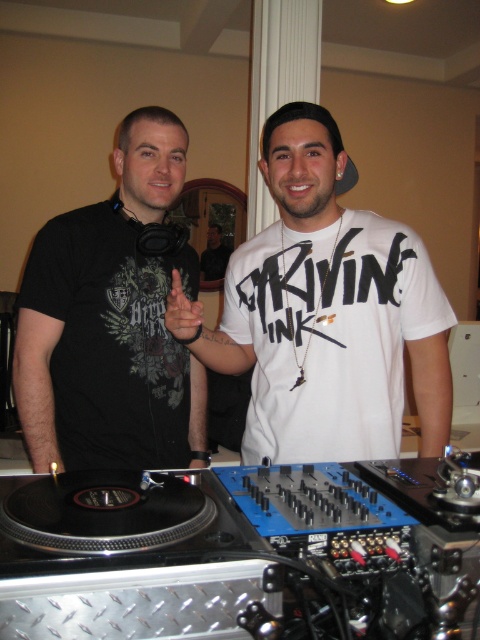
Question: Which object is closer to the camera taking this photo?

Choices:
 (A) white matte t-shirt at center
 (B) black matte t-shirt at left

Answer: (A)

Question: Does white matte t-shirt at center have a lesser width compared to black matte t-shirt at left?

Choices:
 (A) yes
 (B) no

Answer: (B)

Question: Which point is closer to the camera taking this photo?

Choices:
 (A) (385, 308)
 (B) (137, 312)

Answer: (A)

Question: From the image, what is the correct spatial relationship of white matte t-shirt at center in relation to black matte t-shirt at left?

Choices:
 (A) right
 (B) left

Answer: (A)

Question: Does white matte t-shirt at center have a smaller size compared to black matte t-shirt at left?

Choices:
 (A) yes
 (B) no

Answer: (B)

Question: Which of the following is the farthest from the observer?

Choices:
 (A) (28, 378)
 (B) (429, 310)

Answer: (B)